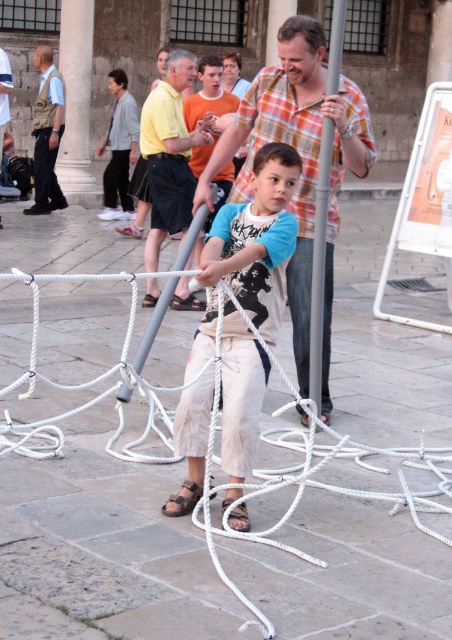
You are a spectator at the event and want to take a photo of the white rope at center and plaid shirt at center. Which object should you focus on if you want to capture the wider one?

The white rope at center might be wider than plaid shirt at center, so focus on the white rope at center to capture the wider object.

Looking at this image, you are standing at the center of the event area and want to take a photo of both the point at coordinates point (253,385) and point (155,168). Which point will appear larger in your camera view?

Point (253,385) is closer to the camera than point (155,168), so it will appear larger in the photo.

You are standing at the center of the scene and want to reach the white rope at center. Which direction should you move to get there?

The white rope at center is located at point 0.747 on the x and 0.212 on the y coordinates, so you should move towards the right and slightly downward from the center to reach it.